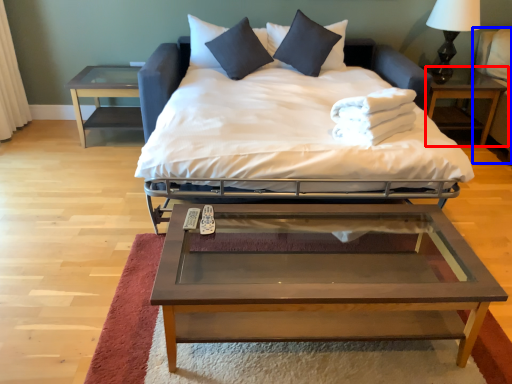
Question: Which object appears farthest to the camera in this image, nightstand (highlighted by a red box) or armchair (highlighted by a blue box)?

Choices:
 (A) nightstand
 (B) armchair

Answer: (A)